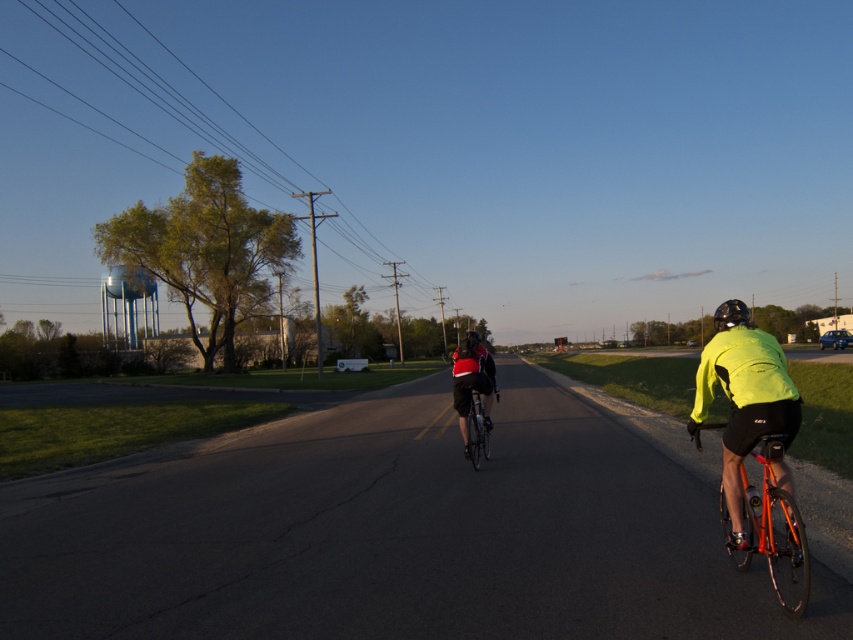
Question: Which object appears farthest from the camera in this image?

Choices:
 (A) matte black jacket at center
 (B) orange metallic bicycle at right
 (C) shiny black helmet at right
 (D) shiny metallic bicycle at center

Answer: (A)

Question: Is orange metallic bicycle at right to the left of matte black jacket at center from the viewer's perspective?

Choices:
 (A) yes
 (B) no

Answer: (B)

Question: Among these points, which one is farthest from the camera?

Choices:
 (A) (715, 310)
 (B) (469, 368)

Answer: (A)

Question: Does orange metallic bicycle at right have a smaller size compared to shiny metallic bicycle at center?

Choices:
 (A) no
 (B) yes

Answer: (A)

Question: Based on their relative distances, which object is farther from the shiny black helmet at right?

Choices:
 (A) matte black jacket at center
 (B) orange metallic bicycle at right
 (C) shiny metallic bicycle at center

Answer: (A)

Question: Is orange metallic bicycle at right thinner than shiny black helmet at right?

Choices:
 (A) no
 (B) yes

Answer: (B)